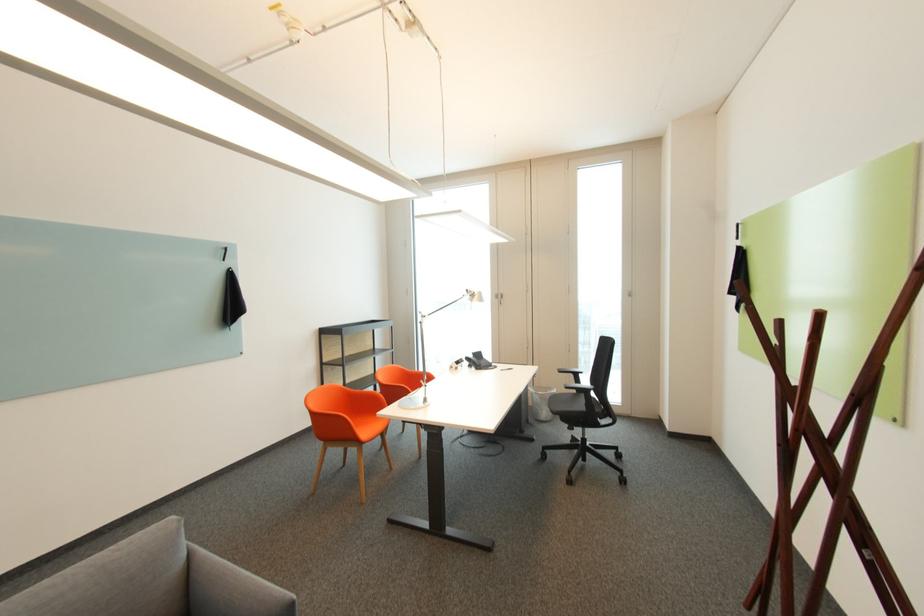
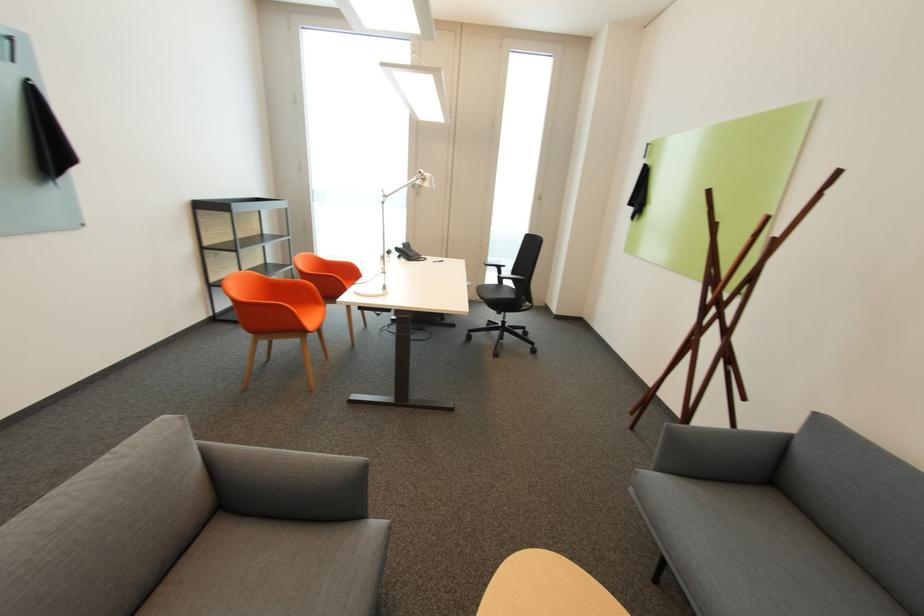
Find the pixel in the second image that matches pixel 485 368 in the first image.

(419, 259)